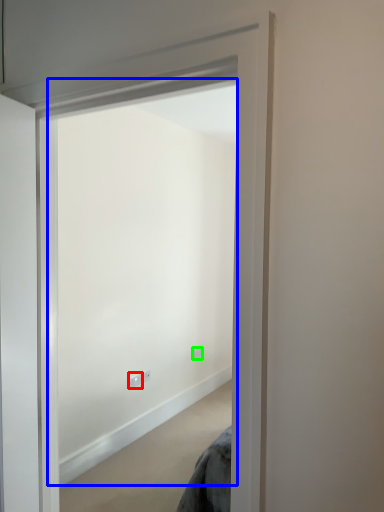
Question: Which is nearer to the electric outlet (highlighted by a red box)? window (highlighted by a blue box) or electric outlet (highlighted by a green box).

Choices:
 (A) window
 (B) electric outlet

Answer: (B)